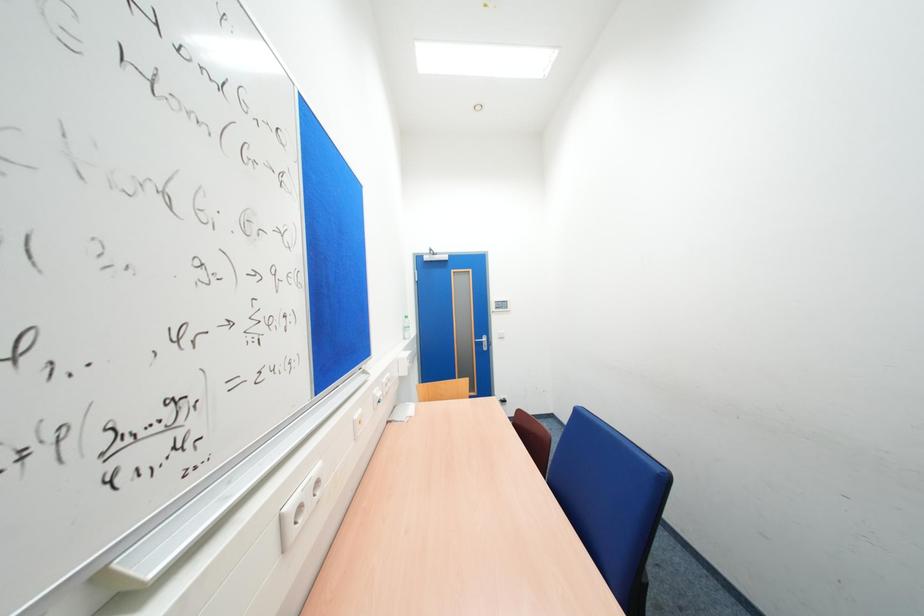
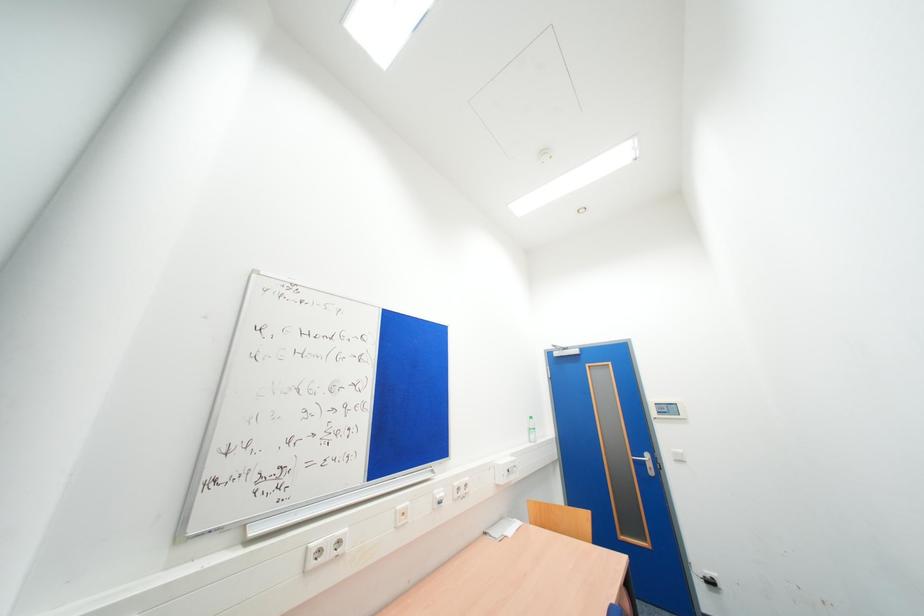
How did the camera likely rotate?

The camera rotated toward left-up.